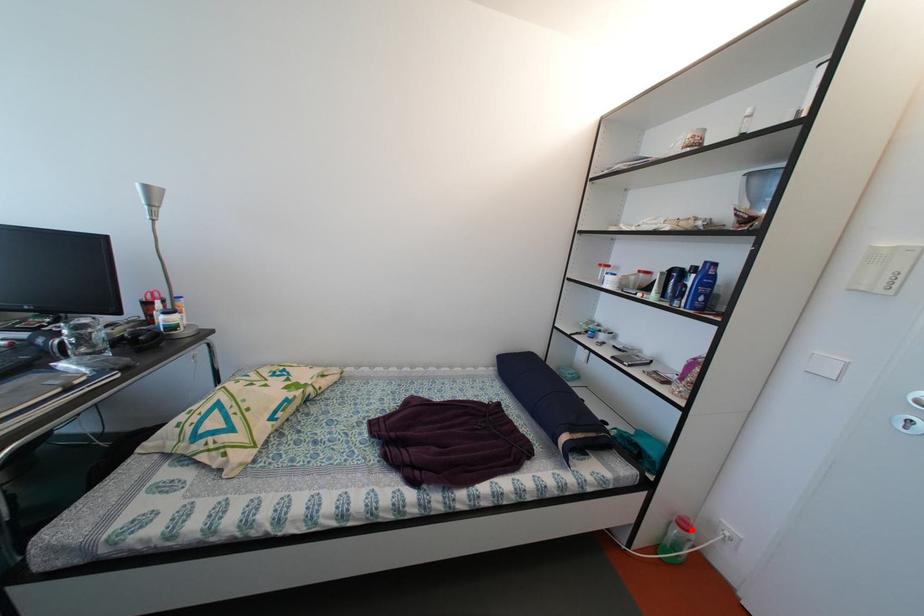
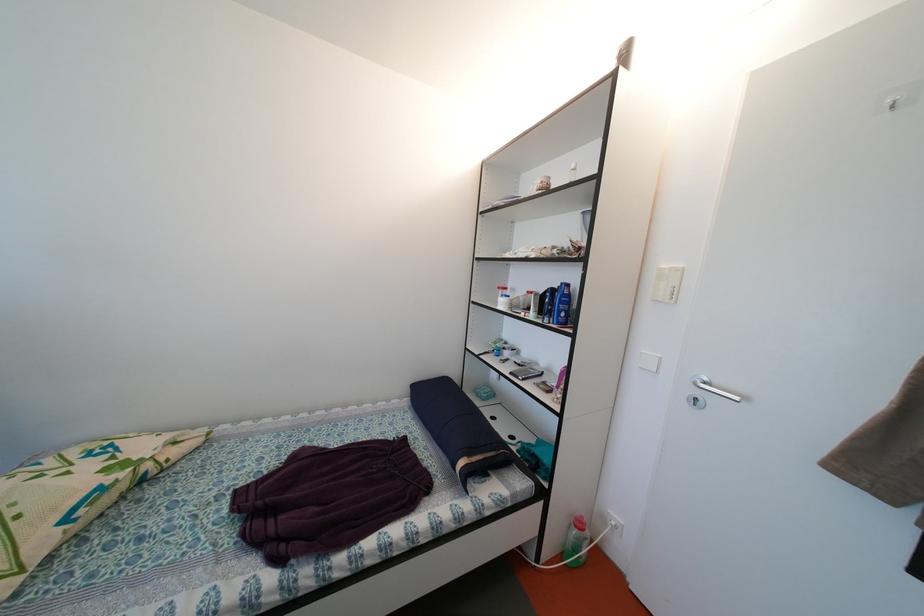
Question: I am providing you with two images of the same scene from different viewpoints. A red point is shown in image1. For the corresponding object point in image2, is it positioned nearer or farther from the camera?

Choices:
 (A) Nearer
 (B) Farther

Answer: (B)